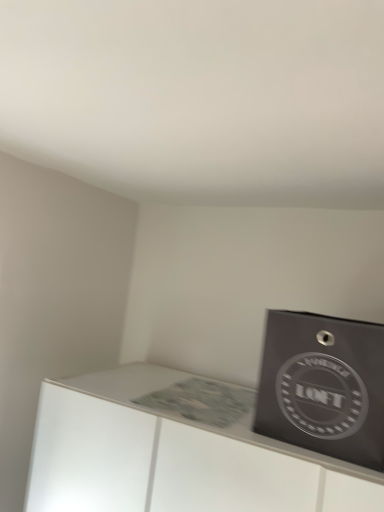
This screenshot has height=512, width=384. What do you see at coordinates (323, 386) in the screenshot? I see `black glossy plaque at right` at bounding box center [323, 386].

Measure the distance between point (371, 454) and camera.

A distance of 90.80 centimeters exists between point (371, 454) and camera.

This screenshot has width=384, height=512. In order to click on black glossy plaque at right in this screenshot , I will do `click(323, 386)`.

Image resolution: width=384 pixels, height=512 pixels. What are the coordinates of `black glossy plaque at right` in the screenshot? It's located at (323, 386).